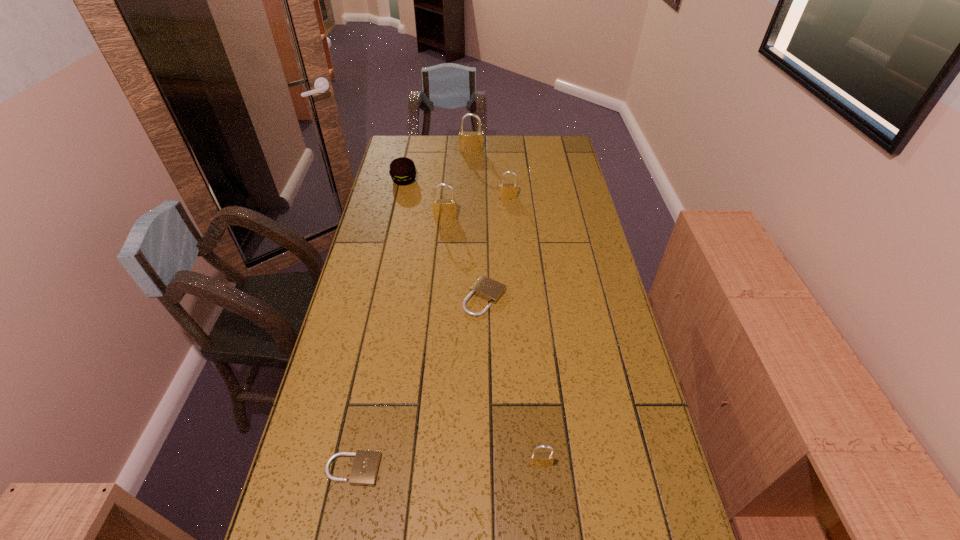
Identify which beige padlock is located as the second nearest to the fifth shortest object. Please provide its 2D coordinates. Your answer should be formatted as a tuple, i.e. [(x, y)], where the tuple contains the x and y coordinates of a point satisfying the conditions above.

[(365, 467)]